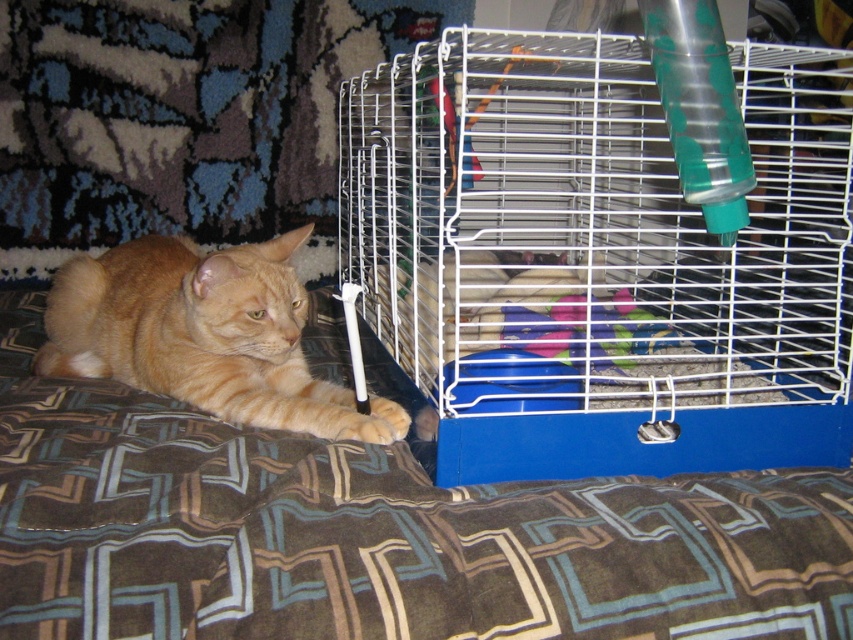
Who is positioned more to the right, white wire birdcage at center or brown fabric bed at lower left?

white wire birdcage at center is more to the right.

Is point (814, 250) positioned behind point (412, 499)?

Yes.

Image resolution: width=853 pixels, height=640 pixels. Describe the element at coordinates (602, 256) in the screenshot. I see `white wire birdcage at center` at that location.

I want to click on white wire birdcage at center, so click(x=602, y=256).

Does white wire birdcage at center appear on the right side of orange fur cat at left?

Yes, white wire birdcage at center is to the right of orange fur cat at left.

Between white wire birdcage at center and orange fur cat at left, which one is positioned lower?

orange fur cat at left is lower down.

Is point (389, 170) closer to viewer compared to point (309, 392)?

Yes, point (389, 170) is closer to viewer.

Identify the location of white wire birdcage at center. (602, 256).

Which is above, brown fabric bed at lower left or orange fur cat at left?

orange fur cat at left

Which is below, brown fabric bed at lower left or orange fur cat at left?

Positioned lower is brown fabric bed at lower left.

Where is `brown fabric bed at lower left`? brown fabric bed at lower left is located at coordinates (375, 532).